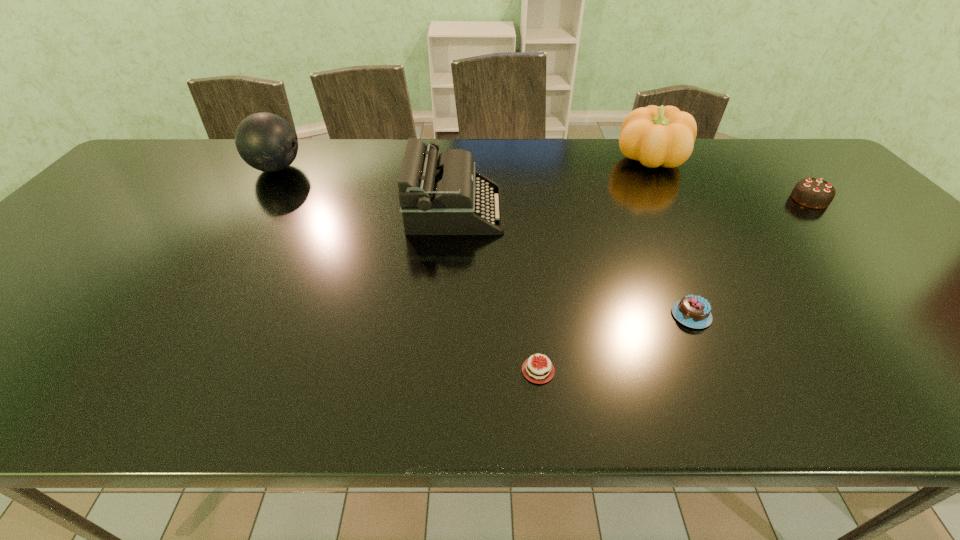
Where is `free space located 0.140m on the grip area of the bowling ball`? The width and height of the screenshot is (960, 540). free space located 0.140m on the grip area of the bowling ball is located at coordinates (348, 168).

You are a GUI agent. You are given a task and a screenshot of the screen. Output one action in this format:
    pyautogui.click(x=<x>, y=<y>)
    Task: Click on the free space located 0.400m on the typing side of the typewriter
    This screenshot has height=540, width=960.
    Given the screenshot: What is the action you would take?
    pyautogui.click(x=647, y=210)

Where is `free space located 0.200m on the front of the farthest chocolate cake`? The image size is (960, 540). free space located 0.200m on the front of the farthest chocolate cake is located at coordinates (864, 257).

This screenshot has height=540, width=960. Identify the location of vacant area located 0.260m on the right of the second chocolate cake from right to left. (831, 315).

The width and height of the screenshot is (960, 540). What are the coordinates of `blank space located on the right of the nearest object` in the screenshot? It's located at (626, 370).

Locate an element on the screen. The height and width of the screenshot is (540, 960). pumpkin located at the far edge is located at coordinates (656, 136).

You are a GUI agent. You are given a task and a screenshot of the screen. Output one action in this format:
    pyautogui.click(x=<x>, y=<y>)
    Task: Click on the bowling ball situated at the far edge
    
    Given the screenshot: What is the action you would take?
    pyautogui.click(x=267, y=142)

I want to click on object that is at the near edge, so click(535, 370).

What are the coordinates of `object present at the right edge` in the screenshot? It's located at (814, 193).

At what (x,y) coordinates should I click in order to perform the action: click on free space at the far edge of the desktop. Please return your answer as a coordinate pair (x, y). This screenshot has height=540, width=960. Looking at the image, I should click on (586, 156).